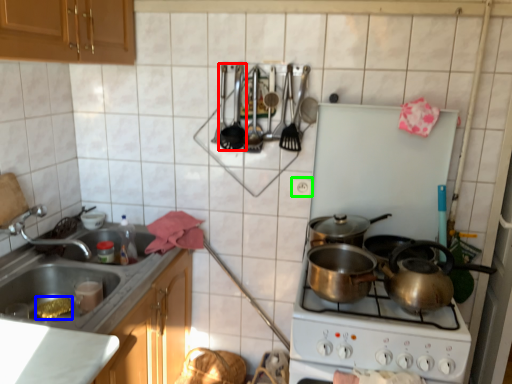
Question: Estimate the real-world distances between objects in this image. Which object is farther from appliance (highlighted by a red box), food (highlighted by a blue box) or electric outlet (highlighted by a green box)?

Choices:
 (A) food
 (B) electric outlet

Answer: (A)